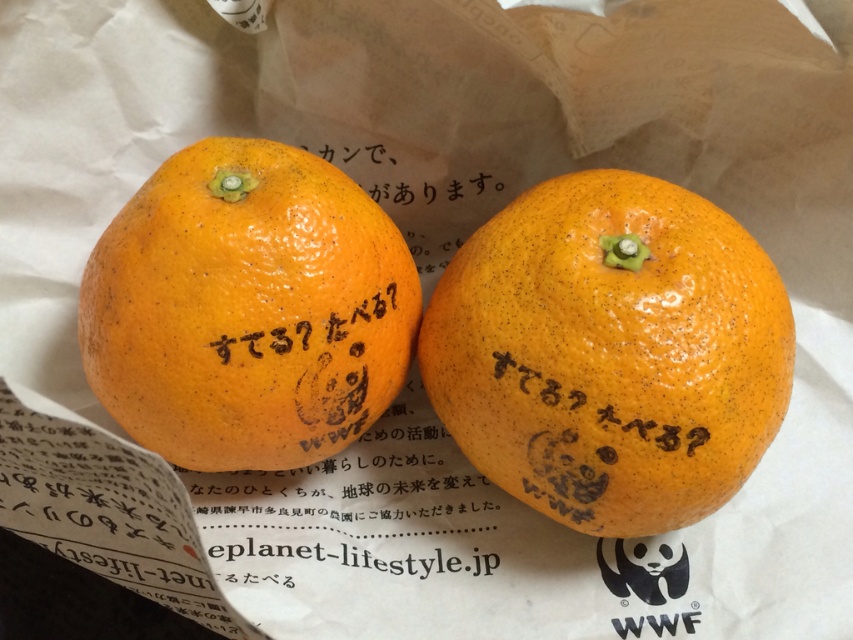
Question: From the image, what is the correct spatial relationship of orangesmoothorange at center in relation to orangesmoothorange at left?

Choices:
 (A) left
 (B) right

Answer: (B)

Question: Is orangesmoothorange at center to the right of orangesmoothorange at left from the viewer's perspective?

Choices:
 (A) no
 (B) yes

Answer: (B)

Question: Does orangesmoothorange at center appear under orangesmoothorange at left?

Choices:
 (A) no
 (B) yes

Answer: (B)

Question: Which point is closer to the camera taking this photo?

Choices:
 (A) (x=302, y=337)
 (B) (x=534, y=234)

Answer: (A)